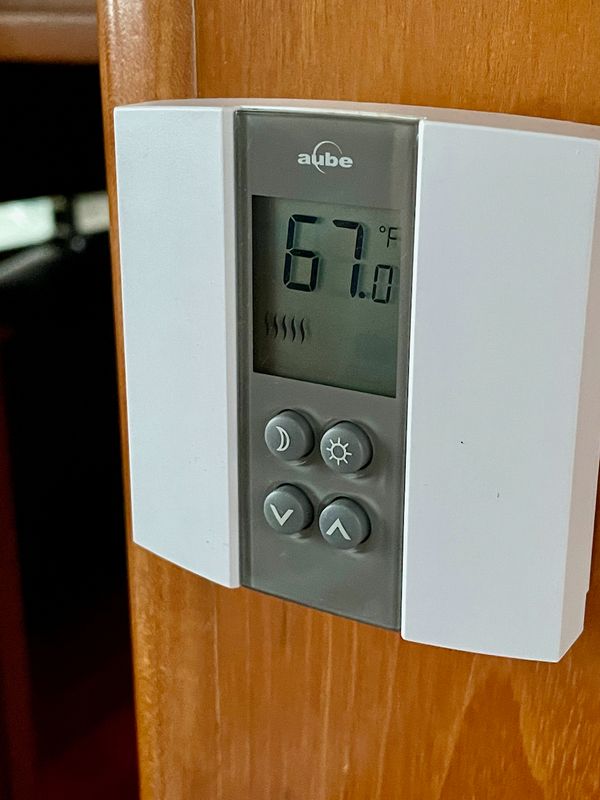
At what (x,y) coordinates should I click in order to perform the action: click on gray thermostat interior. Please return your answer as a coordinate pair (x, y). The width and height of the screenshot is (600, 800). Looking at the image, I should click on (315, 554).